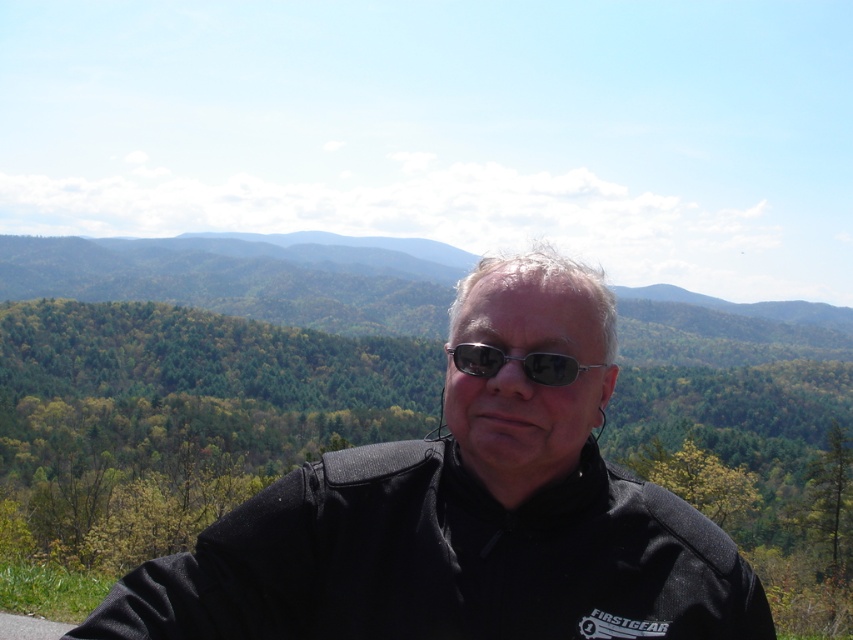
Question: Does black matte jacket at center have a smaller size compared to metallic frame sunglasses at center?

Choices:
 (A) yes
 (B) no

Answer: (B)

Question: Can you confirm if black matte jacket at center is thinner than metallic frame sunglasses at center?

Choices:
 (A) no
 (B) yes

Answer: (A)

Question: Which point is closer to the camera?

Choices:
 (A) metallic frame sunglasses at center
 (B) black matte jacket at center

Answer: (A)

Question: Can you confirm if black matte jacket at center is thinner than metallic frame sunglasses at center?

Choices:
 (A) yes
 (B) no

Answer: (B)